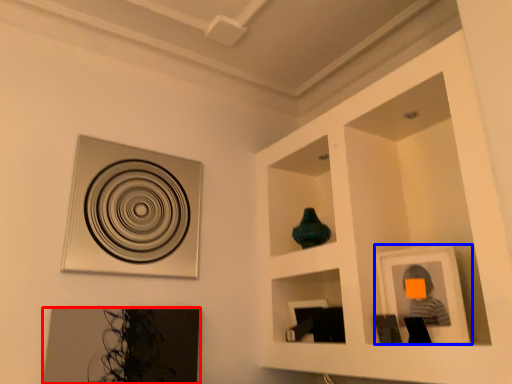
Question: Which of the following is the closest to the observer, picture frame (highlighted by a red box) or picture frame (highlighted by a blue box)?

Choices:
 (A) picture frame
 (B) picture frame

Answer: (B)